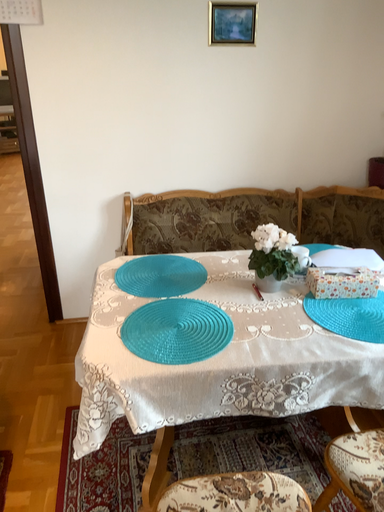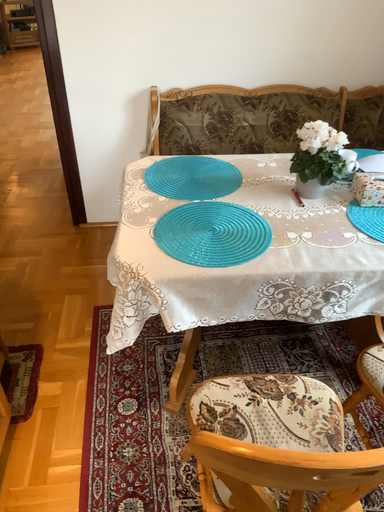
Question: How did the camera likely rotate when shooting the video?

Choices:
 (A) rotated upward
 (B) rotated downward

Answer: (B)